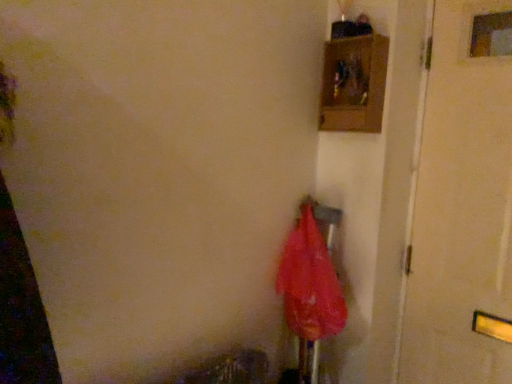
Question: Is translucent red umbrella at center bigger than white matte door at right?

Choices:
 (A) yes
 (B) no

Answer: (B)

Question: Considering the relative positions of translucent red umbrella at center and white matte door at right in the image provided, is translucent red umbrella at center to the right of white matte door at right from the viewer's perspective?

Choices:
 (A) no
 (B) yes

Answer: (A)

Question: Can you confirm if translucent red umbrella at center is positioned to the left of white matte door at right?

Choices:
 (A) no
 (B) yes

Answer: (B)

Question: From the image's perspective, is translucent red umbrella at center below white matte door at right?

Choices:
 (A) no
 (B) yes

Answer: (B)

Question: Is translucent red umbrella at center next to white matte door at right?

Choices:
 (A) no
 (B) yes

Answer: (A)

Question: Is translucent red umbrella at center facing away from white matte door at right?

Choices:
 (A) yes
 (B) no

Answer: (B)

Question: From the image's perspective, is white matte door at right below translucent red umbrella at center?

Choices:
 (A) yes
 (B) no

Answer: (B)

Question: Is the position of white matte door at right more distant than that of translucent red umbrella at center?

Choices:
 (A) no
 (B) yes

Answer: (A)

Question: From a real-world perspective, is white matte door at right positioned over translucent red umbrella at center based on gravity?

Choices:
 (A) no
 (B) yes

Answer: (B)

Question: Is white matte door at right positioned in front of translucent red umbrella at center?

Choices:
 (A) no
 (B) yes

Answer: (B)

Question: Considering the relative sizes of white matte door at right and translucent red umbrella at center in the image provided, is white matte door at right taller than translucent red umbrella at center?

Choices:
 (A) no
 (B) yes

Answer: (B)

Question: From the image's perspective, does white matte door at right appear higher than translucent red umbrella at center?

Choices:
 (A) yes
 (B) no

Answer: (A)

Question: Does point (466, 74) appear closer or farther from the camera than point (318, 226)?

Choices:
 (A) closer
 (B) farther

Answer: (A)